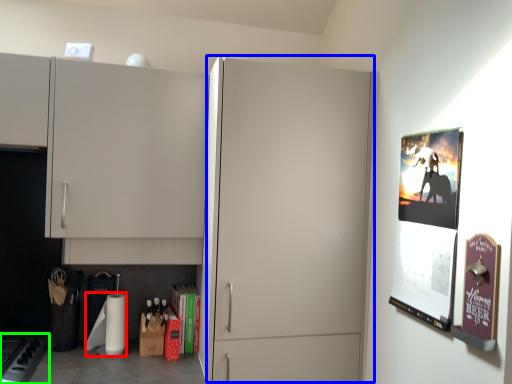
Question: Estimate the real-world distances between objects in this image. Which object is farther from toilet paper (highlighted by a red box), glass door (highlighted by a blue box) or gas stove (highlighted by a green box)?

Choices:
 (A) glass door
 (B) gas stove

Answer: (A)